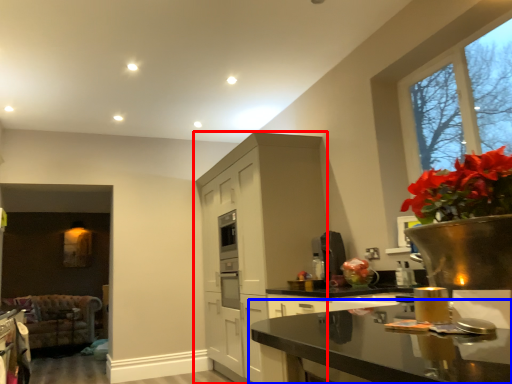
Question: Which object is further to the camera taking this photo, cabinetry (highlighted by a red box) or countertop (highlighted by a blue box)?

Choices:
 (A) cabinetry
 (B) countertop

Answer: (A)